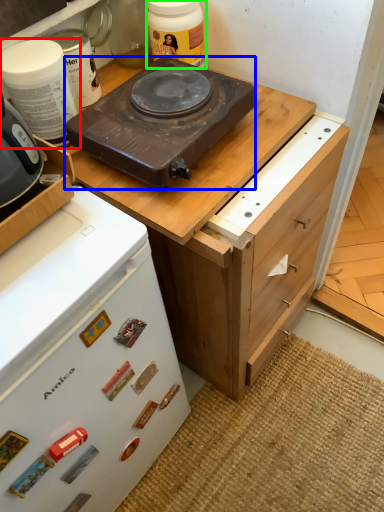
Question: Considering the real-world distances, which object is farthest from kitchen appliance (highlighted by a red box)? kitchen appliance (highlighted by a blue box) or kitchen appliance (highlighted by a green box)?

Choices:
 (A) kitchen appliance
 (B) kitchen appliance

Answer: (B)